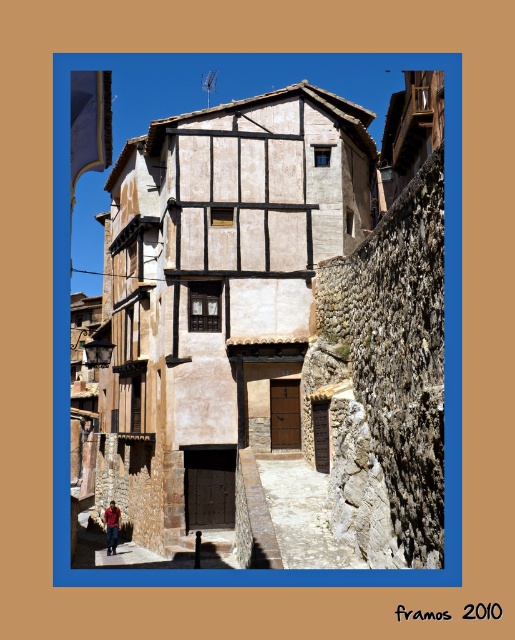
From the picture: Measure the distance from brown wooden house at center to red cotton shirt at lower left.

brown wooden house at center and red cotton shirt at lower left are 19.45 meters apart.

Can you confirm if brown wooden house at center is taller than red cotton shirt at lower left?

A: Yes.

Identify the location of brown wooden house at center. The height and width of the screenshot is (640, 515). (277, 330).